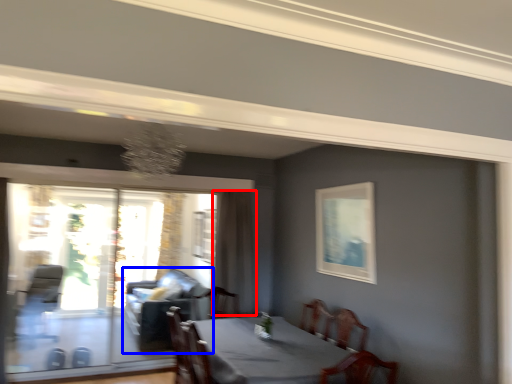
Question: Which object appears farthest to the camera in this image, curtain (highlighted by a red box) or couch (highlighted by a blue box)?

Choices:
 (A) curtain
 (B) couch

Answer: (B)